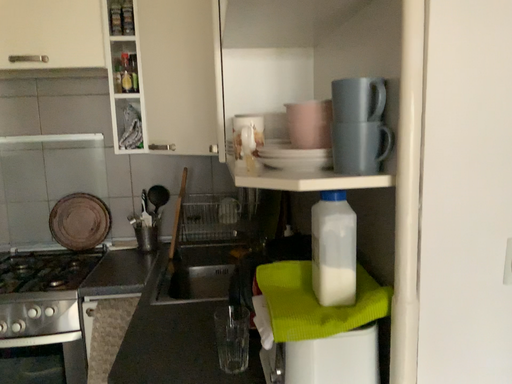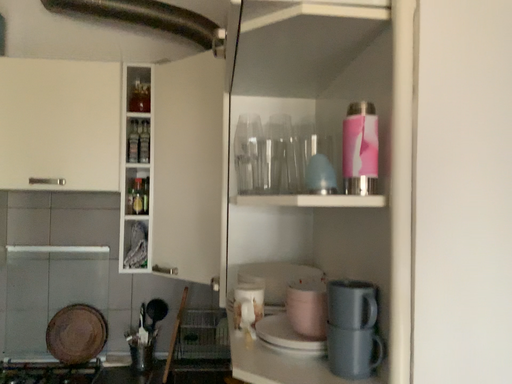
Question: Which way did the camera rotate in the video?

Choices:
 (A) rotated upward
 (B) rotated downward

Answer: (A)